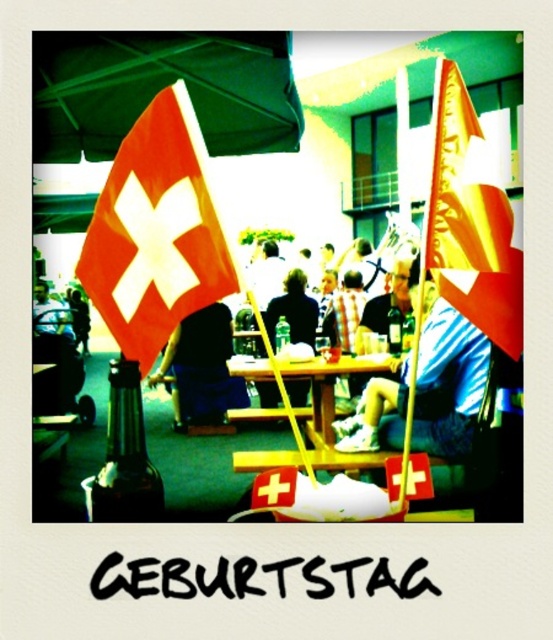
You are at a birthday party and see two shirts at the center of the image. The blue striped shirt at center and the dark blue shirt at center. Which one is closer to you?

The blue striped shirt at center is in front of the dark blue shirt at center, so it is closer to you.

You are setting up a birthday party and want to place a 12 inch wide decoration between the dark blue fabric at center and the yellow wood picnic table at center. Is there enough space?

The dark blue fabric at center and yellow wood picnic table at center are 36.86 inches apart, so yes, there is enough space to place a 12 inch wide decoration between them since 36.86 inches is greater than 12 inches.